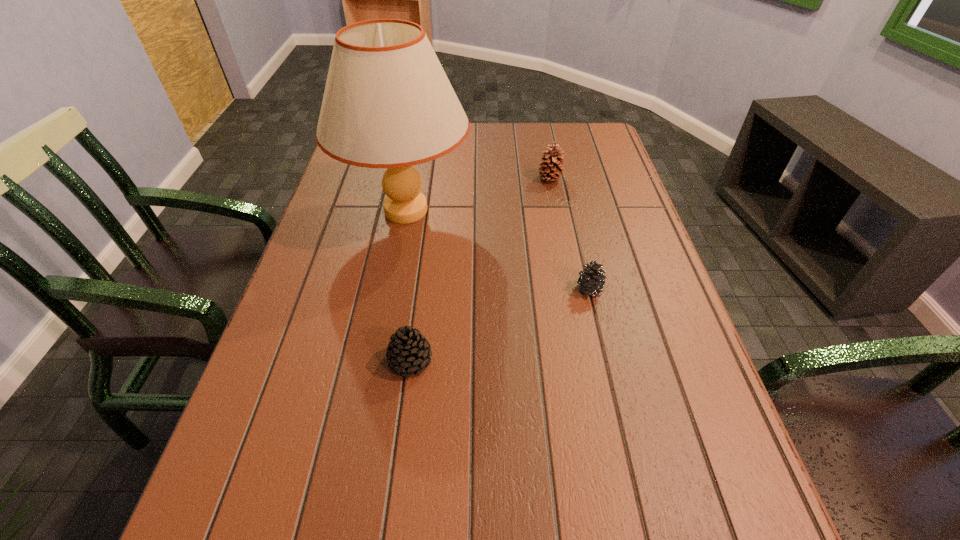
What are the coordinates of `blank area in the image that satisfies the following two spatial constraints: 1. on the front side of the second nearest pinecone; 2. on the right side of the farthest pinecone` in the screenshot? It's located at (572, 289).